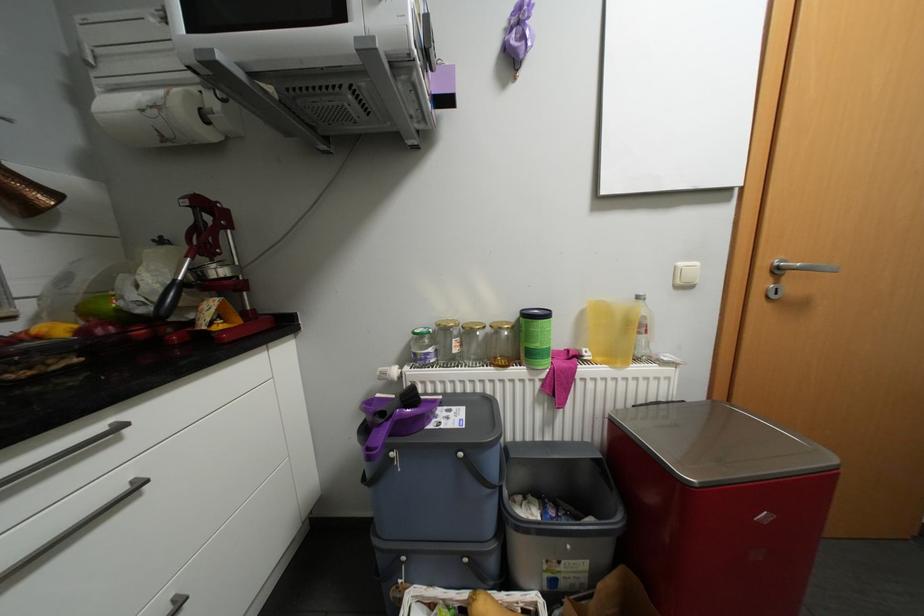
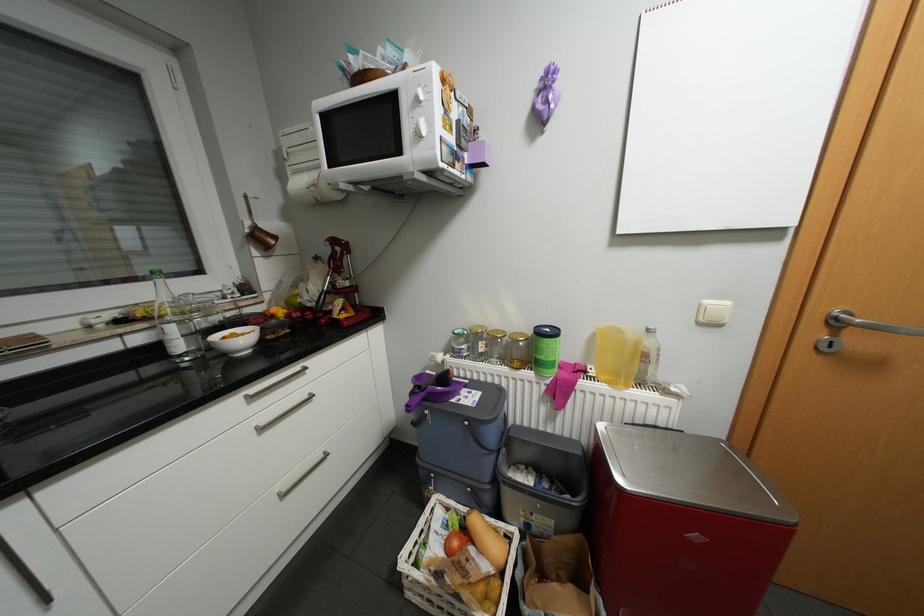
Where in the second image is the point corresponding to point (438, 349) from the first image?

(471, 345)